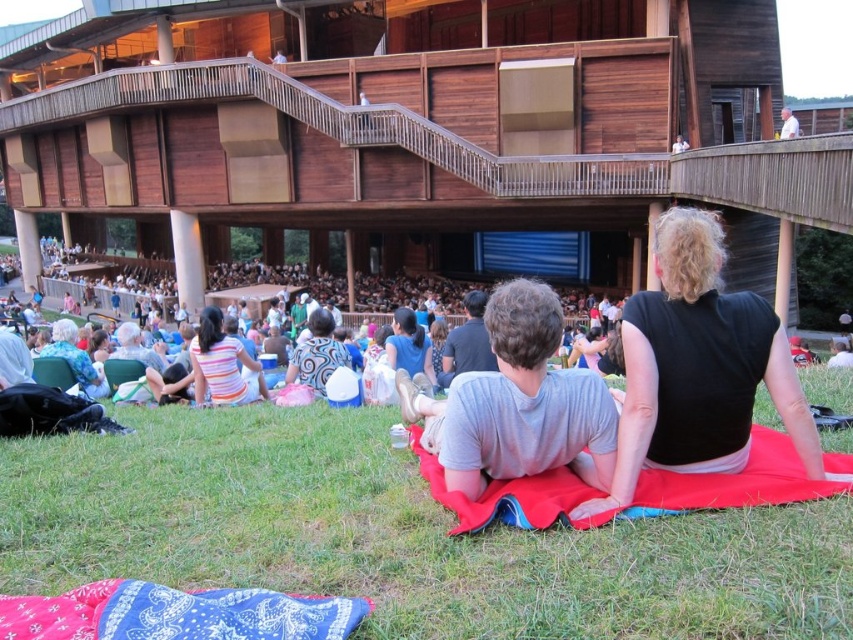
Question: Does red fabric blanket at lower center lie behind striped cotton shirt at center?

Choices:
 (A) yes
 (B) no

Answer: (B)

Question: Which of the following is the farthest from the observer?

Choices:
 (A) red fabric blanket at lower center
 (B) black matte shirt at center
 (C) striped cotton shirt at center

Answer: (C)

Question: Can you confirm if striped cotton shirt at center is wider than white shirt at upper right?

Choices:
 (A) yes
 (B) no

Answer: (B)

Question: Which object appears farthest from the camera in this image?

Choices:
 (A) wooden balcony at upper center
 (B) black matte shirt at center
 (C) dark gray shirt at center
 (D) red fabric blanket at lower center

Answer: (A)

Question: Can you confirm if red fabric blanket at lower center is positioned to the right of striped cotton shirt at center?

Choices:
 (A) no
 (B) yes

Answer: (B)

Question: Which object appears closest to the camera in this image?

Choices:
 (A) green grass at lower center
 (B) gray cotton shirt at center

Answer: (A)